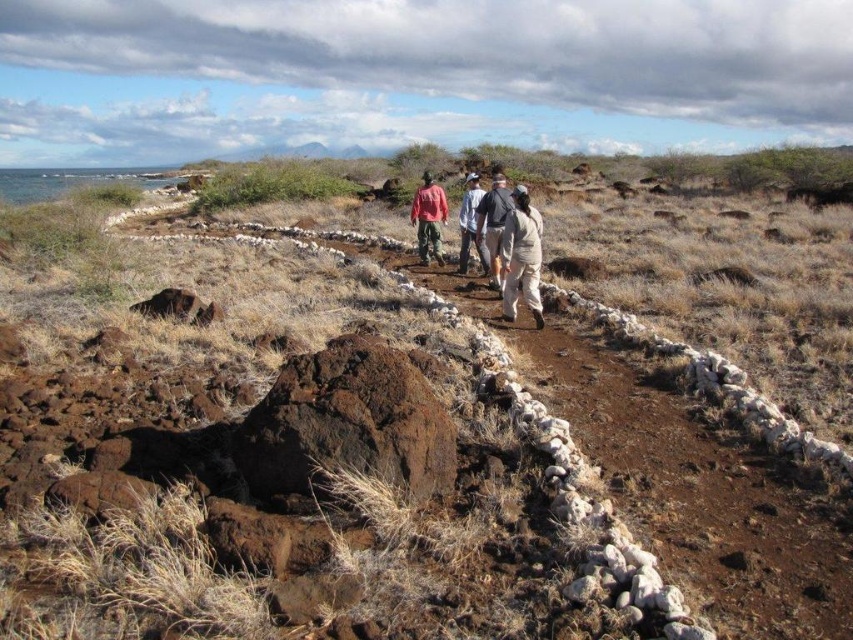
You are standing at the starting point of the path and want to reach the end of the path. Which of the two points, point [537,296] or point [421,256], is closer to you as you begin your journey?

Point [537,296] is closer to the viewer than point [421,256], so it is the closer point as you begin your journey.

You are a photographer trying to capture a group of hikers on a rugged path. You notice the tan fabric pants at center and the matte red shirt at center. Which clothing item would you focus on to ensure it takes up more of the photo frame?

The matte red shirt at center occupies more space than the tan fabric pants at center, so focusing on the matte red shirt at center would ensure it takes up more of the photo frame.